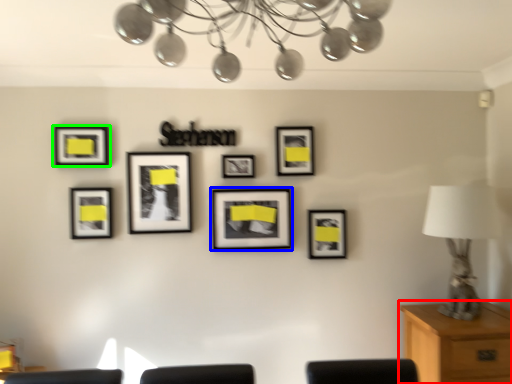
Question: Estimate the real-world distances between objects in this image. Which object is closer to table (highlighted by a red box), picture frame (highlighted by a blue box) or picture frame (highlighted by a green box)?

Choices:
 (A) picture frame
 (B) picture frame

Answer: (A)